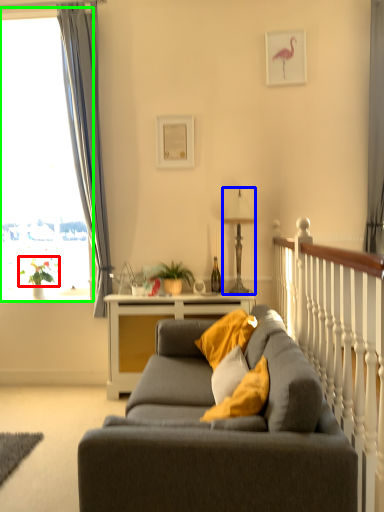
Question: Which object is positioned closest to plant (highlighted by a red box)? Select from lamp (highlighted by a blue box) and bay window (highlighted by a green box).

Choices:
 (A) lamp
 (B) bay window

Answer: (B)